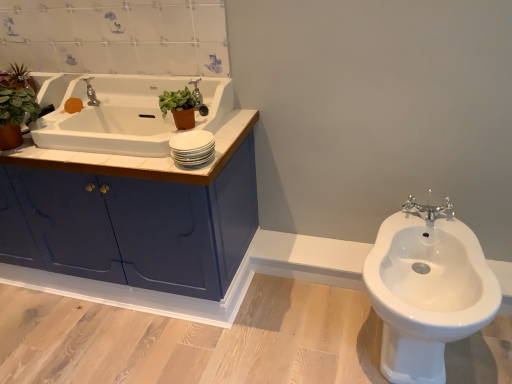
Image resolution: width=512 pixels, height=384 pixels. In order to click on vacant point to the right of green matte plant at upper center, marked as the first plant in a front-to-back arrangement in this screenshot , I will do `click(237, 119)`.